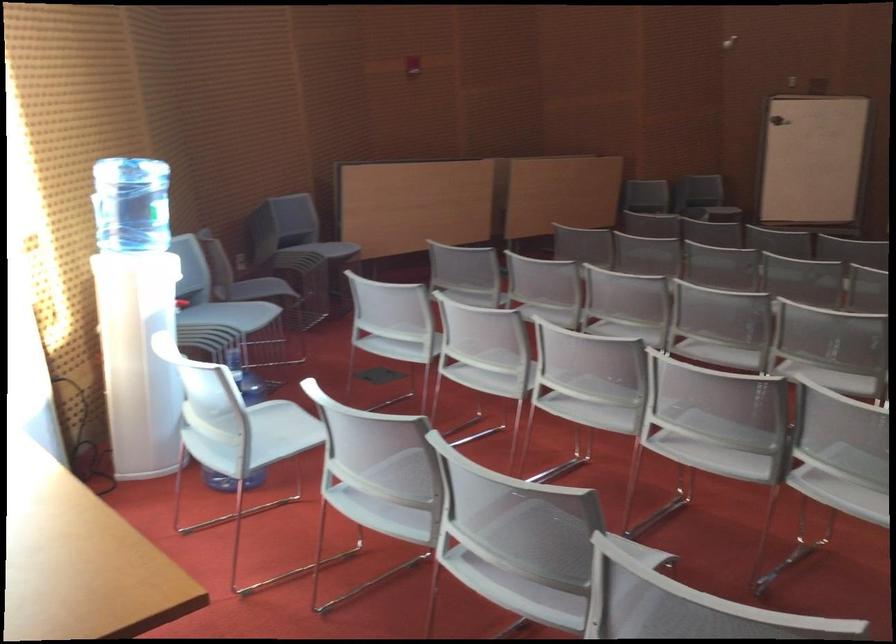
Where would you lift the blue water bottle? Please return your answer as a coordinate pair (x, y).

(131, 204)